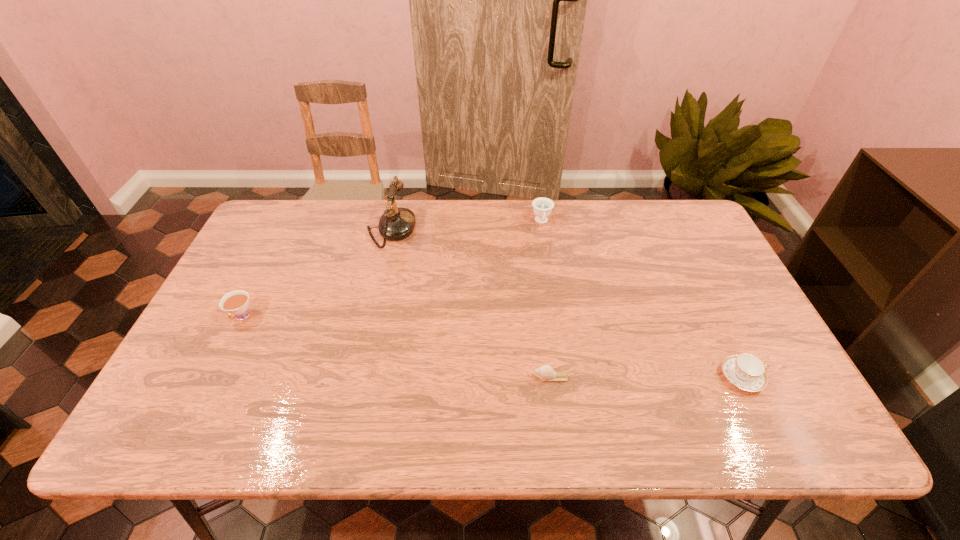
You are a GUI agent. You are given a task and a screenshot of the screen. Output one action in this format:
    pyautogui.click(x=<x>, y=<y>)
    Task: Click on the free space that satisfies the following two spatial constraints: 1. on the dial of the fourth object from right to left; 2. on the side of the leftmost object with the handle
    The height and width of the screenshot is (540, 960).
    Given the screenshot: What is the action you would take?
    pyautogui.click(x=371, y=317)